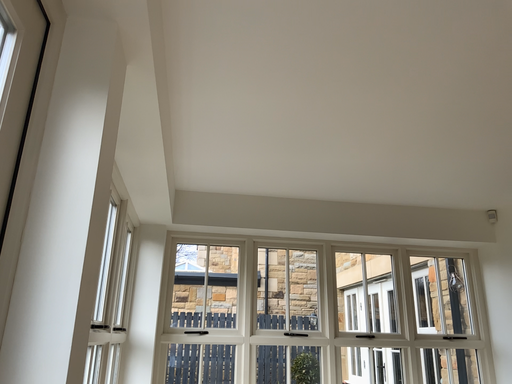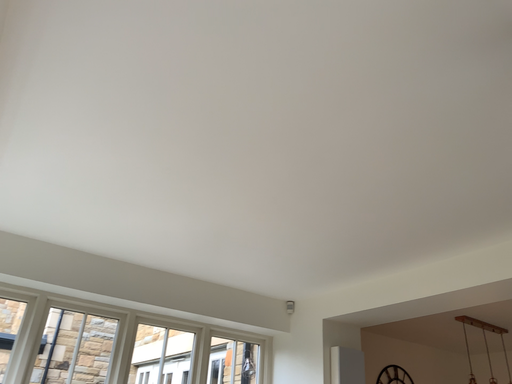
Question: Which way did the camera rotate in the video?

Choices:
 (A) rotated downward
 (B) rotated upward

Answer: (B)